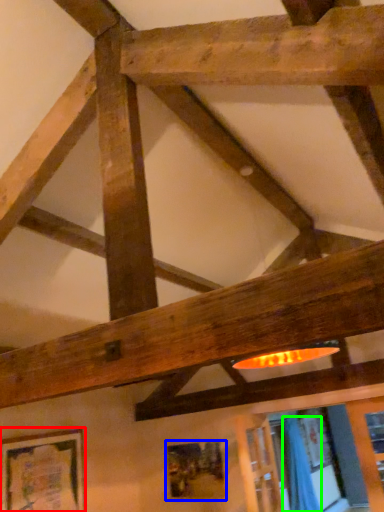
Question: Which is nearer to the picture frame (highlighted by a red box)? picture frame (highlighted by a blue box) or curtain (highlighted by a green box).

Choices:
 (A) picture frame
 (B) curtain

Answer: (A)